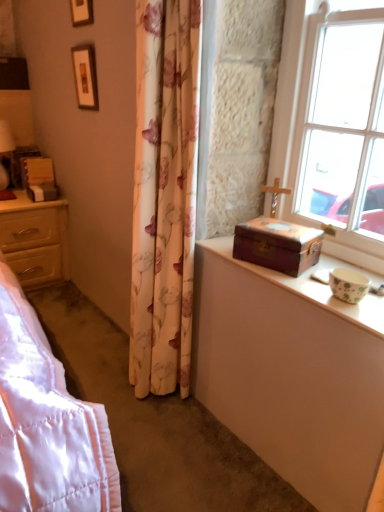
Question: From a real-world perspective, is wooden picture frame at upper left, acting as the first picture frame starting from the top, under wooden treasure chest at window sill?

Choices:
 (A) yes
 (B) no

Answer: (B)

Question: Are wooden picture frame at upper left, placed as the 2th picture frame when sorted from bottom to top, and wooden treasure chest at window sill located far from each other?

Choices:
 (A) yes
 (B) no

Answer: (A)

Question: Is wooden picture frame at upper left, placed as the 2th picture frame when sorted from bottom to top, at the right side of wooden treasure chest at window sill?

Choices:
 (A) yes
 (B) no

Answer: (B)

Question: Considering the relative sizes of wooden picture frame at upper left, placed as the 2th picture frame when sorted from bottom to top, and wooden treasure chest at window sill in the image provided, is wooden picture frame at upper left, placed as the 2th picture frame when sorted from bottom to top, bigger than wooden treasure chest at window sill?

Choices:
 (A) no
 (B) yes

Answer: (A)

Question: From the image's perspective, is wooden picture frame at upper left, placed as the 2th picture frame when sorted from bottom to top, located above wooden treasure chest at window sill?

Choices:
 (A) yes
 (B) no

Answer: (A)

Question: From the image's perspective, is wooden picture frame at upper left, acting as the first picture frame starting from the top, beneath wooden treasure chest at window sill?

Choices:
 (A) yes
 (B) no

Answer: (B)

Question: Can you confirm if wooden chest at right is smaller than matte white table lamp at left?

Choices:
 (A) yes
 (B) no

Answer: (A)

Question: Considering the relative sizes of wooden chest at right and matte white table lamp at left in the image provided, is wooden chest at right wider than matte white table lamp at left?

Choices:
 (A) no
 (B) yes

Answer: (B)

Question: Is the position of wooden chest at right more distant than that of matte white table lamp at left?

Choices:
 (A) yes
 (B) no

Answer: (B)

Question: Is wooden chest at right oriented towards matte white table lamp at left?

Choices:
 (A) no
 (B) yes

Answer: (A)

Question: Considering the relative sizes of wooden chest at right and matte white table lamp at left in the image provided, is wooden chest at right bigger than matte white table lamp at left?

Choices:
 (A) no
 (B) yes

Answer: (A)

Question: From a real-world perspective, is wooden chest at right on matte white table lamp at left?

Choices:
 (A) no
 (B) yes

Answer: (A)

Question: Does matte white table lamp at left lie in front of floral fabric curtain at center?

Choices:
 (A) yes
 (B) no

Answer: (B)